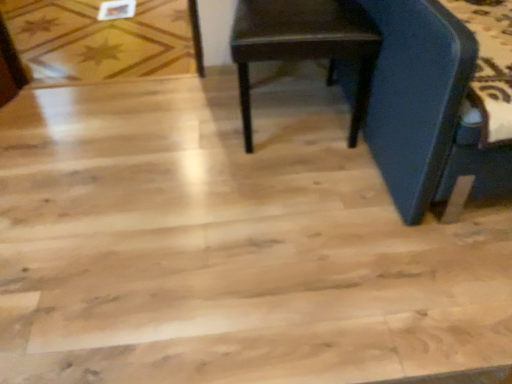
Where is `blank space to the left of dark brown wood chair at center`? blank space to the left of dark brown wood chair at center is located at coordinates (177, 129).